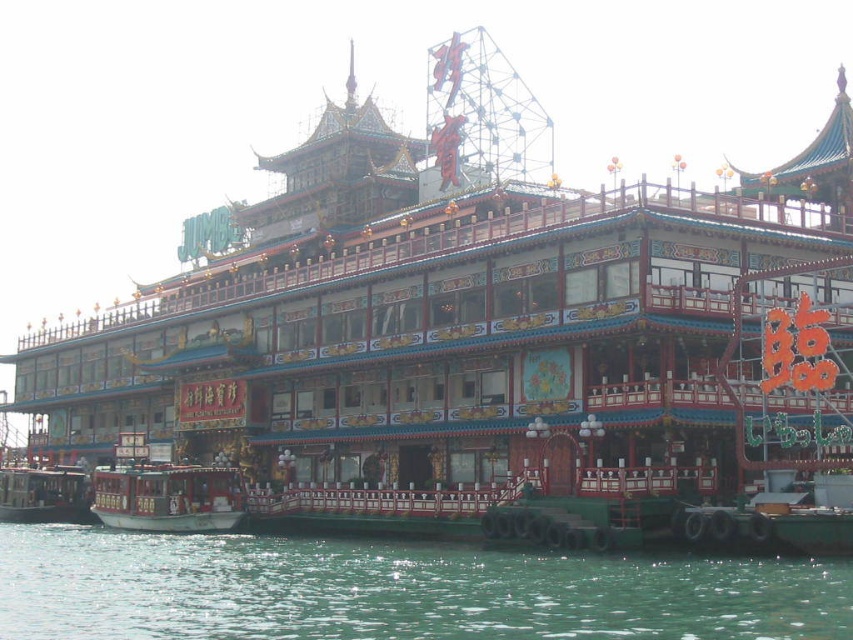
Question: Which of the following is the closest to the observer?

Choices:
 (A) (85, 515)
 (B) (577, 576)

Answer: (B)

Question: Which point is farther to the camera?

Choices:
 (A) (36, 481)
 (B) (379, 609)

Answer: (A)

Question: Does green water at lower center have a greater width compared to black polished wood boat at lower left?

Choices:
 (A) no
 (B) yes

Answer: (B)

Question: Can you confirm if green water at lower center is wider than black polished wood boat at lower left?

Choices:
 (A) yes
 (B) no

Answer: (A)

Question: Is green water at lower center positioned behind black polished wood boat at lower left?

Choices:
 (A) yes
 (B) no

Answer: (B)

Question: Which of the following is the closest to the observer?

Choices:
 (A) (422, 586)
 (B) (18, 468)

Answer: (A)